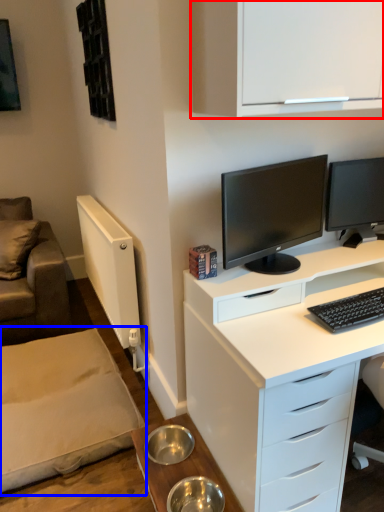
Question: Among these objects, which one is nearest to the camera, cabinetry (highlighted by a red box) or plain (highlighted by a blue box)?

Choices:
 (A) cabinetry
 (B) plain

Answer: (A)